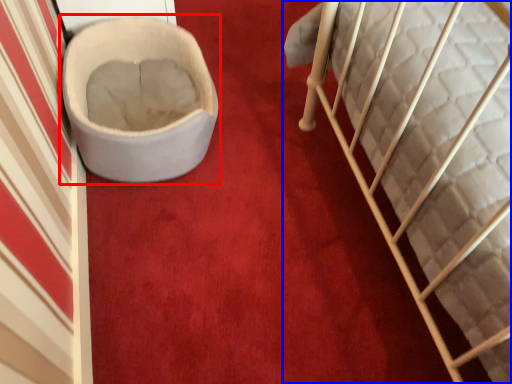
Question: Which object appears closest to the camera in this image, toilet (highlighted by a red box) or furniture (highlighted by a blue box)?

Choices:
 (A) toilet
 (B) furniture

Answer: (B)